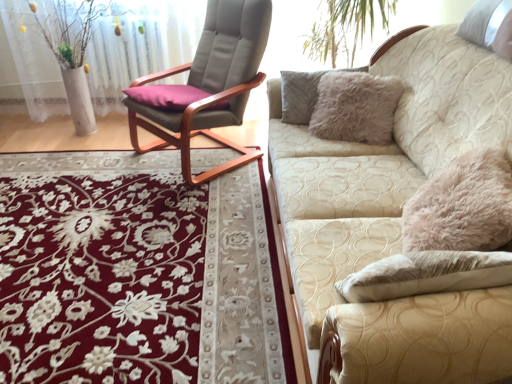
Question: Is white matte vase at left positioned far away from matte gray cushioned chair at center?

Choices:
 (A) yes
 (B) no

Answer: (B)

Question: Can you confirm if white matte vase at left is taller than matte gray cushioned chair at center?

Choices:
 (A) no
 (B) yes

Answer: (A)

Question: Can you confirm if white matte vase at left is positioned to the left of matte gray cushioned chair at center?

Choices:
 (A) no
 (B) yes

Answer: (B)

Question: From a real-world perspective, does white matte vase at left stand above matte gray cushioned chair at center?

Choices:
 (A) no
 (B) yes

Answer: (A)

Question: From the image's perspective, is white matte vase at left located above matte gray cushioned chair at center?

Choices:
 (A) yes
 (B) no

Answer: (A)

Question: Is beige textured couch at right taller or shorter than matte gray cushioned chair at center?

Choices:
 (A) tall
 (B) short

Answer: (B)

Question: Considering the positions of point (414, 81) and point (251, 51), is point (414, 81) closer or farther from the camera than point (251, 51)?

Choices:
 (A) farther
 (B) closer

Answer: (B)

Question: Is beige textured couch at right in front of or behind matte gray cushioned chair at center in the image?

Choices:
 (A) front
 (B) behind

Answer: (A)

Question: Considering the positions of beige textured couch at right and matte gray cushioned chair at center in the image, is beige textured couch at right wider or thinner than matte gray cushioned chair at center?

Choices:
 (A) wide
 (B) thin

Answer: (A)

Question: Is white matte vase at left wider or thinner than floral carpet at center?

Choices:
 (A) thin
 (B) wide

Answer: (A)

Question: Is white matte vase at left bigger or smaller than floral carpet at center?

Choices:
 (A) big
 (B) small

Answer: (A)

Question: From a real-world perspective, is white matte vase at left physically located above or below floral carpet at center?

Choices:
 (A) below
 (B) above

Answer: (B)

Question: Is point (44, 61) closer or farther from the camera than point (100, 291)?

Choices:
 (A) closer
 (B) farther

Answer: (B)

Question: In the image, is matte gray cushioned chair at center positioned in front of or behind beige textured couch at right?

Choices:
 (A) front
 (B) behind

Answer: (B)

Question: From a real-world perspective, is matte gray cushioned chair at center physically located above or below beige textured couch at right?

Choices:
 (A) below
 (B) above

Answer: (B)